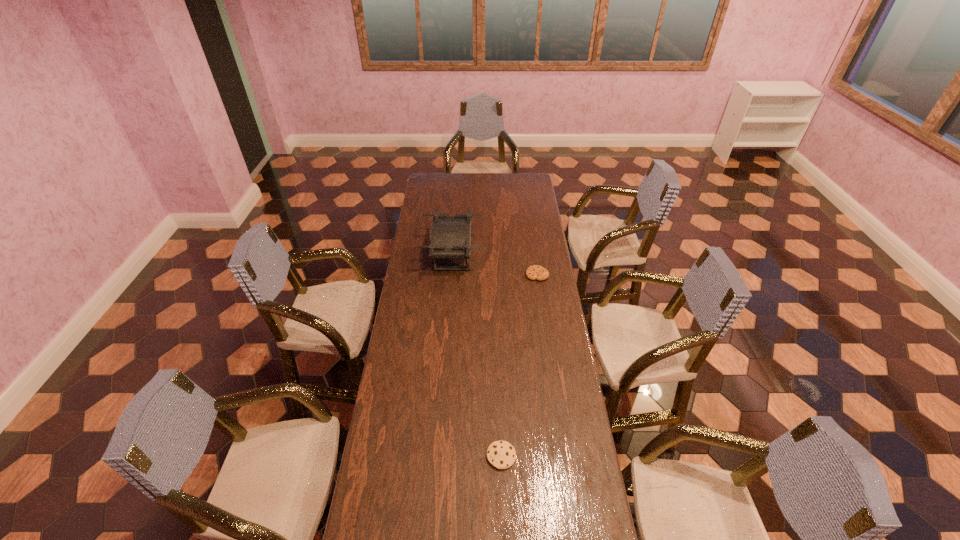
This screenshot has width=960, height=540. In order to click on free region that satisfies the following two spatial constraints: 1. with a camera mounted on the underside of the tallest object; 2. on the left side of the right cookie in this screenshot , I will do `click(451, 275)`.

What are the coordinates of `free point that satisfies the following two spatial constraints: 1. on the back side of the nearer cookie; 2. with a camera mounted on the underside of the drone` in the screenshot? It's located at (493, 256).